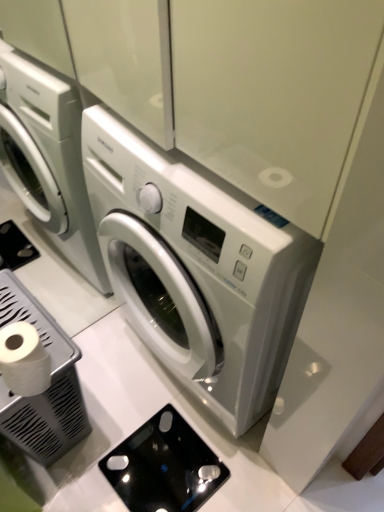
At what (x,y) coordinates should I click in order to perform the action: click on vacant region to the left of black glass scale at lower center, which is the first appliance in right-to-left order. Please return your answer as a coordinate pair (x, y). The height and width of the screenshot is (512, 384). Looking at the image, I should click on (93, 459).